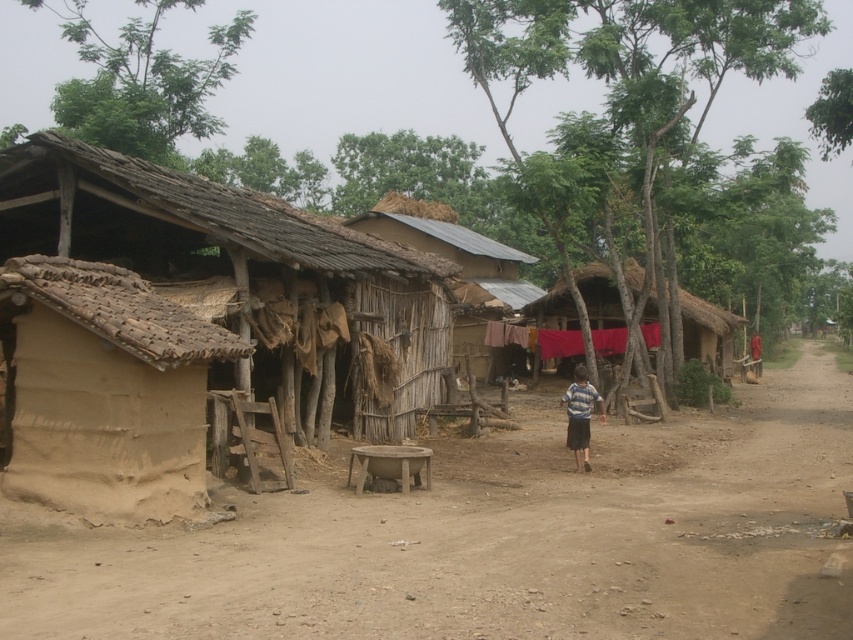
Does brown dirt field at center come behind thatched wood hut at center?

No, brown dirt field at center is in front of thatched wood hut at center.

Measure the distance between point (717, 554) and camera.

Point (717, 554) and camera are 7.86 meters apart.

You are a GUI agent. You are given a task and a screenshot of the screen. Output one action in this format:
    pyautogui.click(x=<x>, y=<y>)
    Task: Click on the brown dirt field at center
    This screenshot has height=640, width=853.
    Given the screenshot: What is the action you would take?
    pyautogui.click(x=491, y=538)

Can you confirm if thatched wood hut at center is positioned above brown wooden stool at center?

Yes.

Is point (424, 227) positioned behind point (402, 481)?

Yes, point (424, 227) is behind point (402, 481).

Is point (416, 244) positioned after point (409, 467)?

Yes, point (416, 244) is behind point (409, 467).

Where is `thatched wood hut at center`? thatched wood hut at center is located at coordinates (459, 264).

Is thatched straw hut at center wider than striped fabric shirt at center?

Correct, the width of thatched straw hut at center exceeds that of striped fabric shirt at center.

Between thatched straw hut at center and striped fabric shirt at center, which one is positioned higher?

thatched straw hut at center is higher up.

What do you see at coordinates (708, 332) in the screenshot? I see `thatched straw hut at center` at bounding box center [708, 332].

This screenshot has width=853, height=640. I want to click on thatched straw hut at center, so click(x=708, y=332).